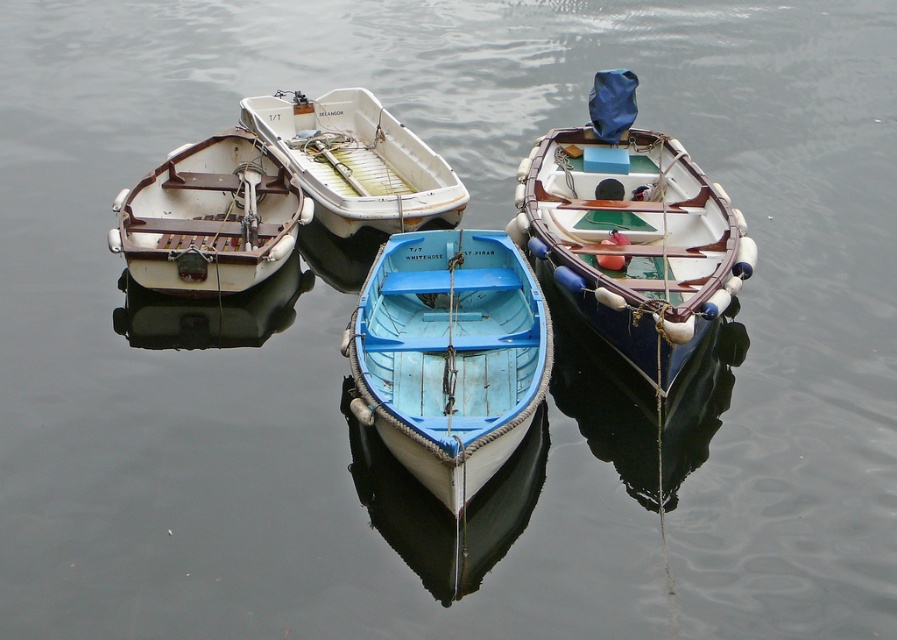
Question: Estimate the real-world distances between objects in this image. Which object is closer to the wooden boat at center?

Choices:
 (A) blue matte boat at center
 (B) white matte boat at left
 (C) white matte boat at upper center

Answer: (A)

Question: From the image, what is the correct spatial relationship of white matte boat at left in relation to white matte boat at upper center?

Choices:
 (A) below
 (B) above

Answer: (A)

Question: Which object appears closest to the camera in this image?

Choices:
 (A) white matte boat at left
 (B) wooden boat at center

Answer: (B)

Question: Which point is closer to the camera taking this photo?

Choices:
 (A) (356, 356)
 (B) (382, 225)
 (C) (621, 355)
 (D) (136, 202)

Answer: (A)

Question: In this image, where is blue matte boat at center located relative to white matte boat at upper center?

Choices:
 (A) above
 (B) below

Answer: (B)

Question: Where is white matte boat at left located in relation to white matte boat at upper center in the image?

Choices:
 (A) above
 (B) below

Answer: (B)